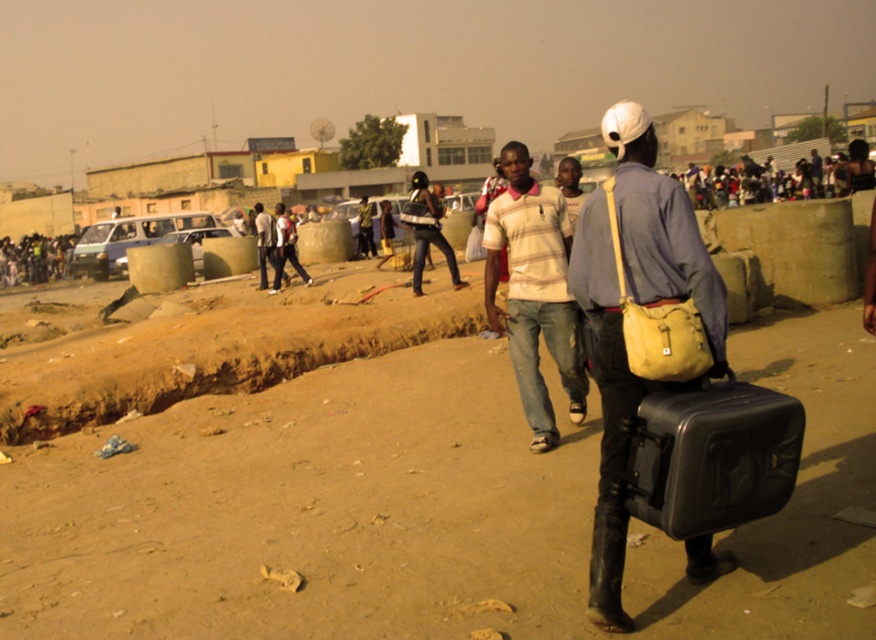
Does brown sandy dirt at center have a lesser height compared to matte black helmet at center?

Indeed, brown sandy dirt at center has a lesser height compared to matte black helmet at center.

What do you see at coordinates (422, 509) in the screenshot? I see `brown sandy dirt at center` at bounding box center [422, 509].

What are the coordinates of `brown sandy dirt at center` in the screenshot? It's located at (422, 509).

Is point (723, 481) farther from viewer compared to point (453, 257)?

No, (723, 481) is in front of (453, 257).

Between black hard case at lower right and matte black helmet at center, which one appears on the right side from the viewer's perspective?

black hard case at lower right

The height and width of the screenshot is (640, 876). I want to click on black hard case at lower right, so click(712, 456).

Looking at this image, can you confirm if brown sandy dirt at center is smaller than black hard case at lower right?

Indeed, brown sandy dirt at center has a smaller size compared to black hard case at lower right.

Between brown sandy dirt at center and black hard case at lower right, which one is positioned higher?

black hard case at lower right is higher up.

Is point (864, 576) positioned before point (743, 483)?

No.

The height and width of the screenshot is (640, 876). I want to click on brown sandy dirt at center, so click(422, 509).